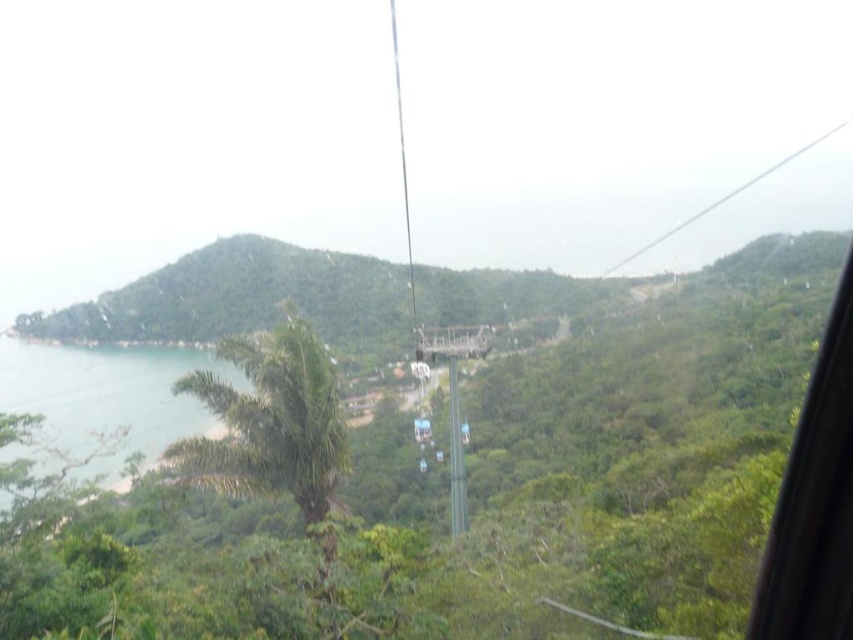
Question: Based on their relative distances, which object is nearer to the green leafy mountain at center?

Choices:
 (A) clear blue water at lower left
 (B) green leafy palm tree at center

Answer: (A)

Question: Observing the image, what is the correct spatial positioning of green leafy mountain at center in reference to green leafy palm tree at center?

Choices:
 (A) above
 (B) below

Answer: (A)

Question: Which is nearer to the clear blue water at lower left?

Choices:
 (A) green leafy mountain at center
 (B) green leafy palm tree at center

Answer: (B)

Question: Where is green leafy palm tree at center located in relation to clear blue water at lower left in the image?

Choices:
 (A) above
 (B) below

Answer: (A)

Question: Which point is farther from the camera taking this photo?

Choices:
 (A) (310, 385)
 (B) (457, 291)

Answer: (B)

Question: Considering the relative positions of green leafy mountain at center and green leafy palm tree at center in the image provided, where is green leafy mountain at center located with respect to green leafy palm tree at center?

Choices:
 (A) left
 (B) right

Answer: (A)